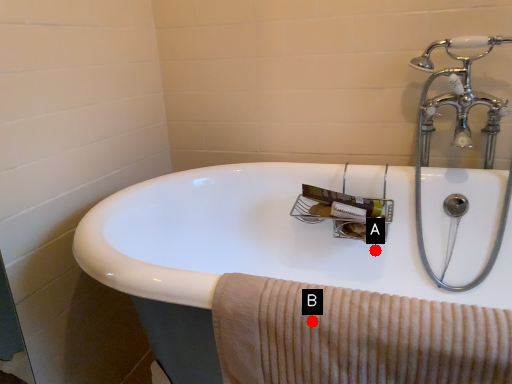
Question: Two points are circled on the image, labeled by A and B beside each circle. Among these points, which one is nearest to the camera?

Choices:
 (A) A is closer
 (B) B is closer

Answer: (B)